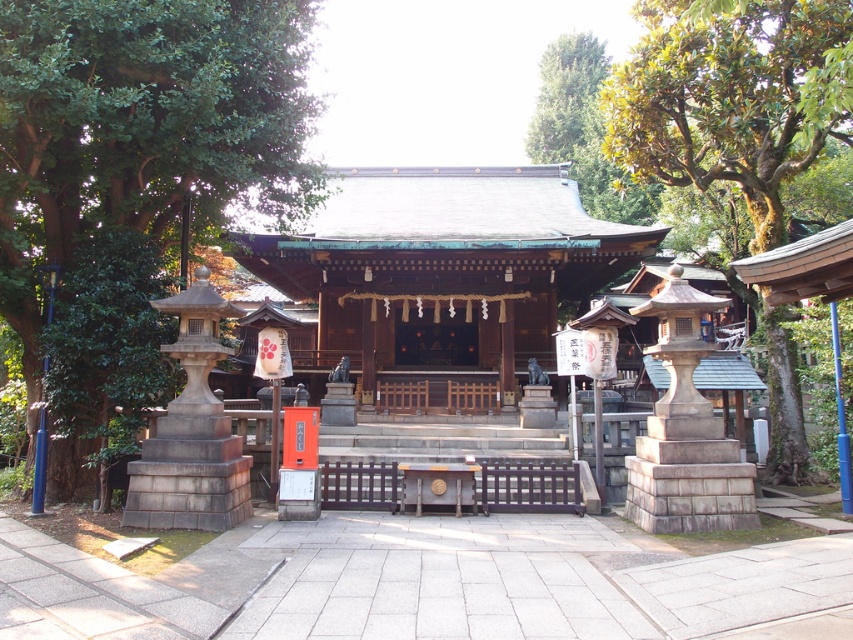
Question: Can you confirm if green leafy tree at left is positioned above green mossy tree at upper right?

Choices:
 (A) no
 (B) yes

Answer: (B)

Question: Which of the following is the farthest from the observer?

Choices:
 (A) green leafy tree at upper center
 (B) green leafy tree at left
 (C) green mossy tree at upper right

Answer: (A)

Question: Does green leafy tree at left appear over green mossy tree at upper right?

Choices:
 (A) yes
 (B) no

Answer: (A)

Question: Considering the real-world distances, which object is closest to the green leafy tree at left?

Choices:
 (A) green leafy tree at upper center
 (B) green mossy tree at upper right

Answer: (B)

Question: Where is green leafy tree at left located in relation to green leafy tree at upper center in the image?

Choices:
 (A) below
 (B) above

Answer: (A)

Question: Among these objects, which one is nearest to the camera?

Choices:
 (A) green leafy tree at left
 (B) green leafy tree at upper center

Answer: (A)